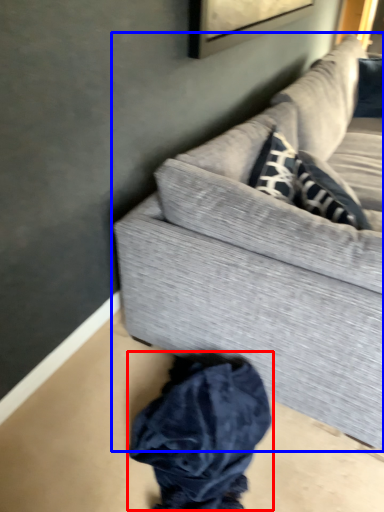
Question: Which object appears farthest to the camera in this image, clothing (highlighted by a red box) or studio couch (highlighted by a blue box)?

Choices:
 (A) clothing
 (B) studio couch

Answer: (A)